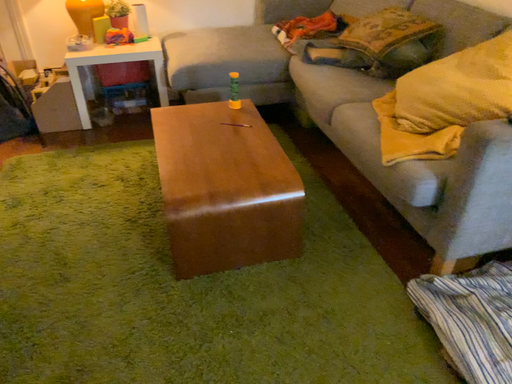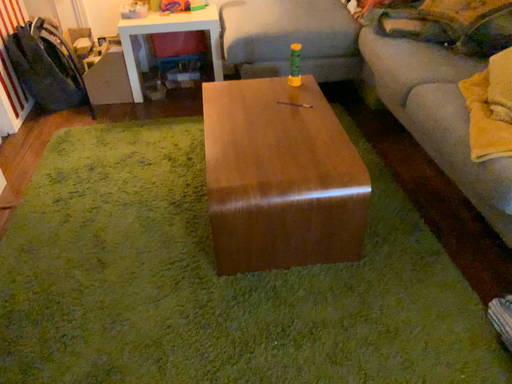
Question: How did the camera likely rotate when shooting the video?

Choices:
 (A) rotated right
 (B) rotated left

Answer: (B)